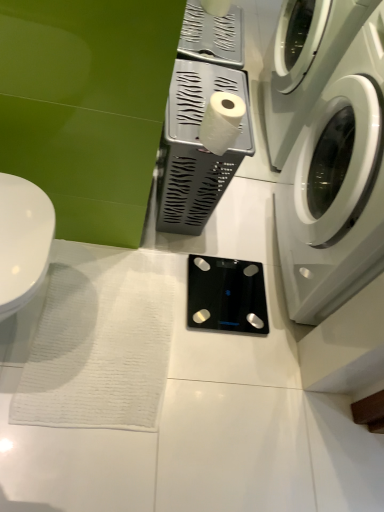
Where is `vacant space situated above black glass scale at center, acting as the 2th appliance starting from the top (from a real-world perspective)`? This screenshot has width=384, height=512. vacant space situated above black glass scale at center, acting as the 2th appliance starting from the top (from a real-world perspective) is located at coordinates (233, 288).